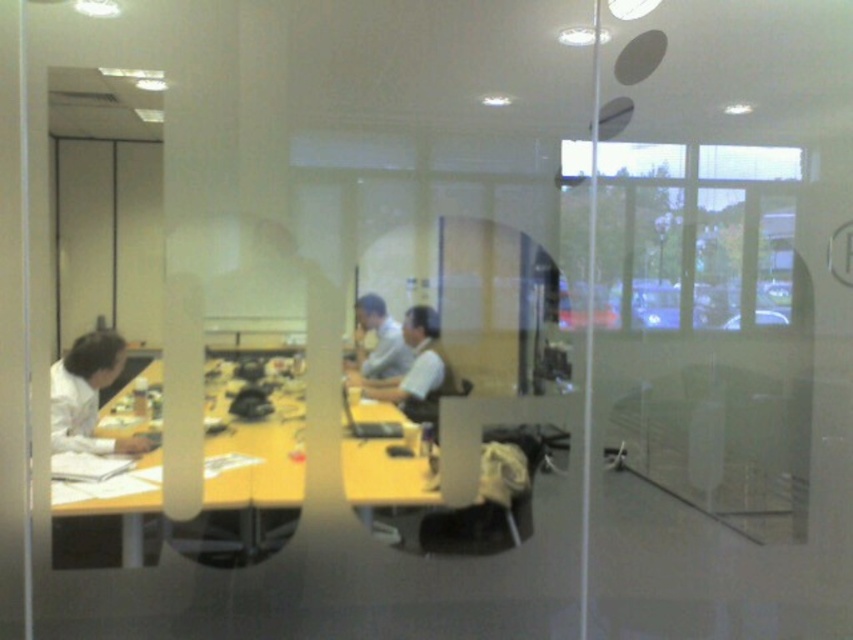
Question: Does white paper at left have a smaller size compared to light brown leather jacket at center?

Choices:
 (A) yes
 (B) no

Answer: (B)

Question: Estimate the real-world distances between objects in this image. Which object is closer to the yellow matte table at lower left?

Choices:
 (A) light brown leather jacket at center
 (B) light gray shirt at center
 (C) white paper at left

Answer: (C)

Question: Which of the following is the closest to the observer?

Choices:
 (A) (421, 403)
 (B) (114, 548)

Answer: (B)

Question: Is light brown leather jacket at center bigger than light gray shirt at center?

Choices:
 (A) no
 (B) yes

Answer: (B)

Question: Does yellow matte table at lower left have a larger size compared to light brown leather jacket at center?

Choices:
 (A) yes
 (B) no

Answer: (A)

Question: Which of the following is the closest to the observer?

Choices:
 (A) yellow matte table at lower left
 (B) white paper at left
 (C) light gray shirt at center
 (D) light brown leather jacket at center

Answer: (B)